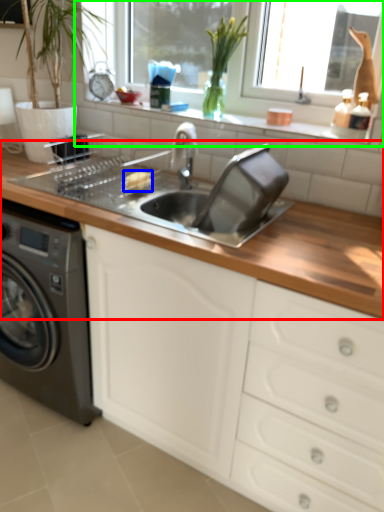
Question: Estimate the real-world distances between objects in this image. Which object is farther from countertop (highlighted by a red box), food (highlighted by a blue box) or window frame (highlighted by a green box)?

Choices:
 (A) food
 (B) window frame

Answer: (B)